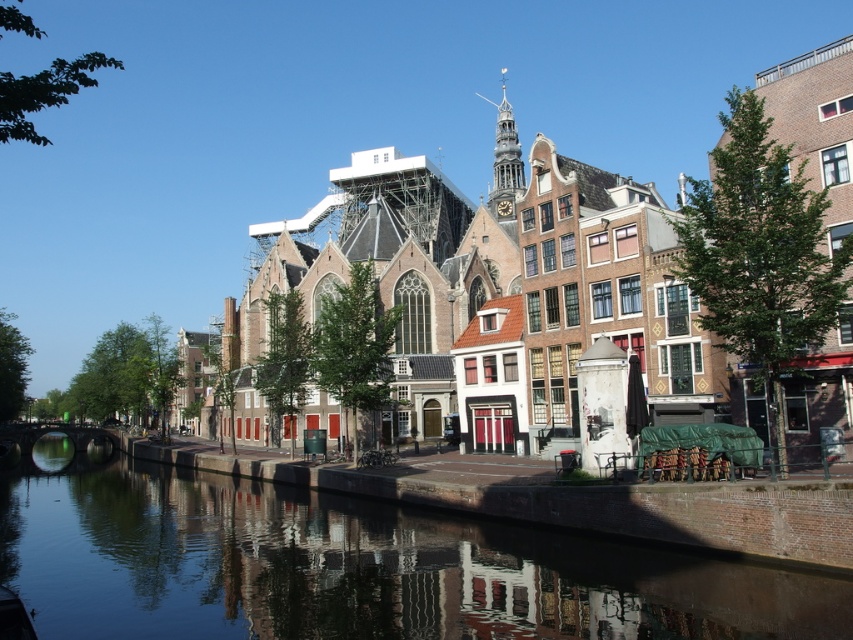
You are a tourist standing on the bank of the canal and want to take a photo that includes both the brown brick church at center and the smooth water at center. Based on their positions, which object should you position to the left side of your camera frame to include both?

To include both the brown brick church at center and the smooth water at center in your photo, you should position the smooth water at center on the left side of your camera frame since the brown brick church at center is to the right of it.

You are a tourist standing on the canal bridge and want to take a photo of the brown brick church at center and the smooth water at center. Which object will appear larger in your photo?

The brown brick church at center will appear larger in the photo because it is much taller than the smooth water at center.